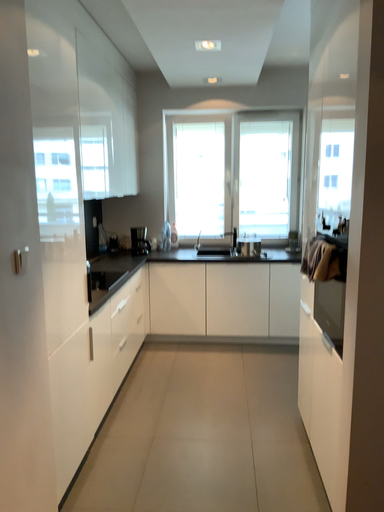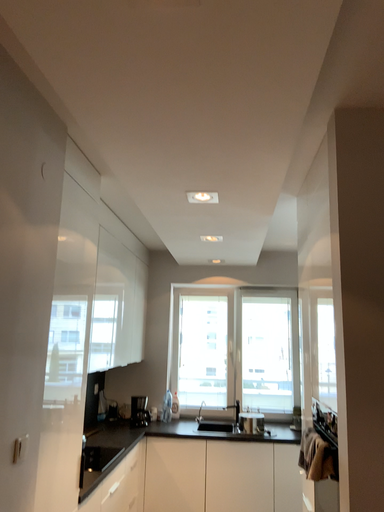
Question: How did the camera likely rotate when shooting the video?

Choices:
 (A) rotated downward
 (B) rotated upward

Answer: (B)